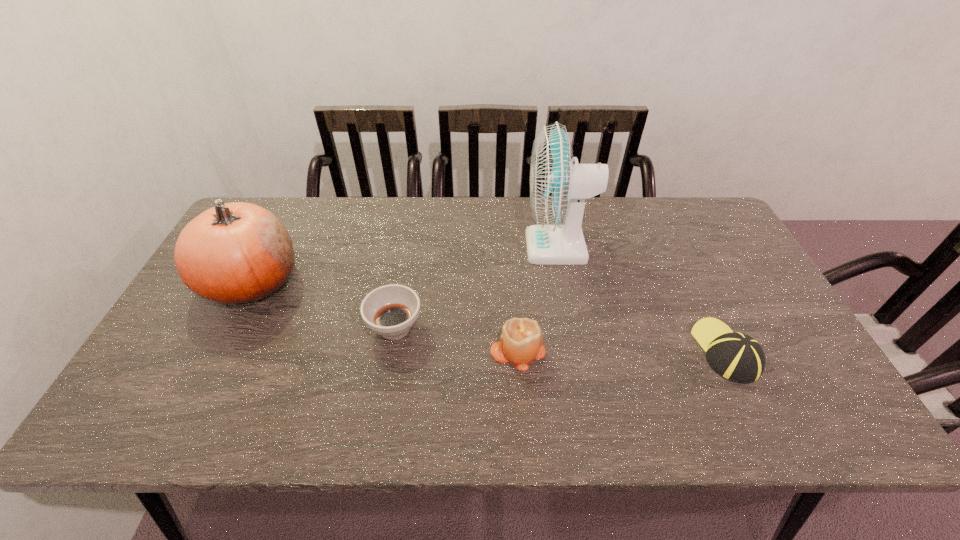
In the image, there is a desktop. Identify the location of vacant area at the left edge. (180, 382).

In order to click on vacant space at the right edge of the desktop in this screenshot , I will do `click(766, 394)`.

This screenshot has height=540, width=960. In the image, there is a desktop. In order to click on vacant space at the near left corner in this screenshot , I will do `click(156, 415)`.

Where is `free space between the baseball cap and the second tallest object`? free space between the baseball cap and the second tallest object is located at coordinates (489, 316).

The width and height of the screenshot is (960, 540). I want to click on vacant point located between the second object from left to right and the third tallest object, so click(456, 339).

Find the location of a particular element. This screenshot has height=540, width=960. empty space that is in between the rightmost object and the fourth shortest object is located at coordinates (489, 316).

At what (x,y) coordinates should I click in order to perform the action: click on free spot between the rightmost object and the pumpkin. Please return your answer as a coordinate pair (x, y). This screenshot has height=540, width=960. Looking at the image, I should click on (489, 316).

This screenshot has height=540, width=960. What are the coordinates of `free space between the rightmost object and the soup bowl` in the screenshot? It's located at (561, 339).

Identify the location of vacant area that lies between the second tallest object and the baseball cap. (489, 316).

Where is `free spot between the second object from left to right and the tallest object`? The image size is (960, 540). free spot between the second object from left to right and the tallest object is located at coordinates (476, 287).